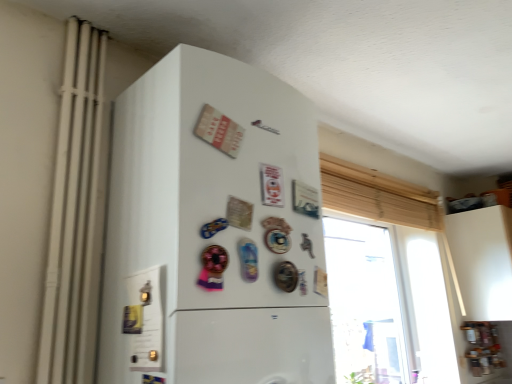
Question: Is translucent glass window at upper right not near white matte radiator at left?

Choices:
 (A) no
 (B) yes

Answer: (B)

Question: From a real-world perspective, is translucent glass window at upper right located beneath white matte radiator at left?

Choices:
 (A) yes
 (B) no

Answer: (A)

Question: Can you confirm if translucent glass window at upper right is positioned to the right of white matte radiator at left?

Choices:
 (A) no
 (B) yes

Answer: (B)

Question: Is translucent glass window at upper right thinner than white matte radiator at left?

Choices:
 (A) no
 (B) yes

Answer: (A)

Question: From the image's perspective, is translucent glass window at upper right on white matte radiator at left?

Choices:
 (A) yes
 (B) no

Answer: (B)

Question: From a real-world perspective, is white matte radiator at left physically located above or below white matte refrigerator at center?

Choices:
 (A) above
 (B) below

Answer: (A)

Question: Considering the positions of white matte radiator at left and white matte refrigerator at center in the image, is white matte radiator at left bigger or smaller than white matte refrigerator at center?

Choices:
 (A) big
 (B) small

Answer: (B)

Question: Looking at their shapes, would you say white matte radiator at left is wider or thinner than white matte refrigerator at center?

Choices:
 (A) thin
 (B) wide

Answer: (A)

Question: Considering the positions of point (72, 306) and point (186, 105), is point (72, 306) closer or farther from the camera than point (186, 105)?

Choices:
 (A) closer
 (B) farther

Answer: (B)

Question: Looking at the image, does translucent glass window at upper right seem bigger or smaller compared to white matte radiator at left?

Choices:
 (A) big
 (B) small

Answer: (A)

Question: From a real-world perspective, is translucent glass window at upper right above or below white matte radiator at left?

Choices:
 (A) below
 (B) above

Answer: (A)

Question: Visually, is translucent glass window at upper right positioned to the left or to the right of white matte radiator at left?

Choices:
 (A) right
 (B) left

Answer: (A)

Question: In the image, is translucent glass window at upper right positioned in front of or behind white matte radiator at left?

Choices:
 (A) front
 (B) behind

Answer: (B)

Question: Is white matte refrigerator at center to the left or to the right of white matte radiator at left in the image?

Choices:
 (A) left
 (B) right

Answer: (B)

Question: Is white matte refrigerator at center situated inside white matte radiator at left or outside?

Choices:
 (A) outside
 (B) inside

Answer: (A)